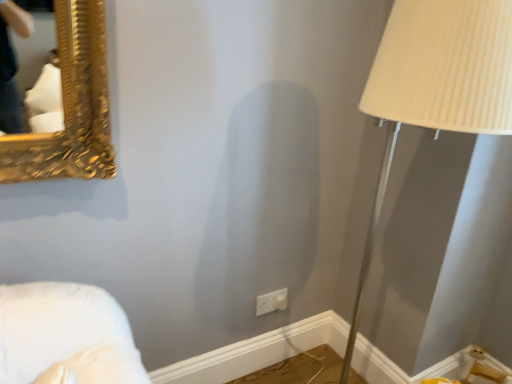
In order to face beige ribbed shade at right, should I rotate leftwards or rightwards?

Turn right approximately 16.696 degrees to face it.

Measure the distance between beige ribbed shade at right and camera.

The depth of beige ribbed shade at right is 27.94 inches.

Locate an element on the screen. This screenshot has height=384, width=512. beige ribbed shade at right is located at coordinates (436, 86).

Describe the element at coordinates (436, 86) in the screenshot. The image size is (512, 384). I see `beige ribbed shade at right` at that location.

Identify the location of white plastic electric outlet at lower center. This screenshot has width=512, height=384. (271, 301).

Describe the element at coordinates (271, 301) in the screenshot. I see `white plastic electric outlet at lower center` at that location.

Locate an element on the screen. beige ribbed shade at right is located at coordinates (436, 86).

Visually, is white plastic electric outlet at lower center positioned to the left or to the right of beige ribbed shade at right?

white plastic electric outlet at lower center is positioned on beige ribbed shade at right's left side.

Is white plastic electric outlet at lower center positioned in front of beige ribbed shade at right?

No, white plastic electric outlet at lower center is further to the viewer.

Between point (270, 295) and point (346, 373), which one is positioned behind?

The point (346, 373) is more distant.

From the image's perspective, is white plastic electric outlet at lower center over beige ribbed shade at right?

Incorrect, from the image's perspective, white plastic electric outlet at lower center is lower than beige ribbed shade at right.

From a real-world perspective, is white plastic electric outlet at lower center physically below beige ribbed shade at right?

Yes, from a real-world perspective, white plastic electric outlet at lower center is below beige ribbed shade at right.

Between white plastic electric outlet at lower center and beige ribbed shade at right, which one has smaller width?

With smaller width is white plastic electric outlet at lower center.

Is white plastic electric outlet at lower center taller than beige ribbed shade at right?

Incorrect, the height of white plastic electric outlet at lower center is not larger of that of beige ribbed shade at right.

Does white plastic electric outlet at lower center have a smaller size compared to beige ribbed shade at right?

Yes.

In the scene shown: Is white plastic electric outlet at lower center inside the boundaries of beige ribbed shade at right, or outside?

white plastic electric outlet at lower center cannot be found inside beige ribbed shade at right.

Is white plastic electric outlet at lower center next to beige ribbed shade at right?

They are not placed beside each other.

Does white plastic electric outlet at lower center turn towards beige ribbed shade at right?

Yes, white plastic electric outlet at lower center faces towards beige ribbed shade at right.

Can you tell me how much white plastic electric outlet at lower center and beige ribbed shade at right differ in facing direction?

90 degrees separate the facing orientations of white plastic electric outlet at lower center and beige ribbed shade at right.

Where is `electric outlet on the left of beige ribbed shade at right`? This screenshot has width=512, height=384. electric outlet on the left of beige ribbed shade at right is located at coordinates (271, 301).

Based on the photo, does beige ribbed shade at right appear on the right side of white plastic electric outlet at lower center?

Yes, beige ribbed shade at right is to the right of white plastic electric outlet at lower center.

Relative to white plastic electric outlet at lower center, is beige ribbed shade at right in front or behind?

Visually, beige ribbed shade at right is located in front of white plastic electric outlet at lower center.

Looking at this image, which is closer, (461, 51) or (276, 294)?

The point (461, 51) is in front.

From the image's perspective, who appears lower, beige ribbed shade at right or white plastic electric outlet at lower center?

white plastic electric outlet at lower center.

From a real-world perspective, is beige ribbed shade at right located beneath white plastic electric outlet at lower center?

No, from a real-world perspective, beige ribbed shade at right is not below white plastic electric outlet at lower center.

Based on the photo, considering the sizes of beige ribbed shade at right and white plastic electric outlet at lower center in the image, is beige ribbed shade at right wider or thinner than white plastic electric outlet at lower center?

beige ribbed shade at right is wider than white plastic electric outlet at lower center.

Can you confirm if beige ribbed shade at right is shorter than white plastic electric outlet at lower center?

In fact, beige ribbed shade at right may be taller than white plastic electric outlet at lower center.

Considering the sizes of objects beige ribbed shade at right and white plastic electric outlet at lower center in the image provided, who is smaller, beige ribbed shade at right or white plastic electric outlet at lower center?

white plastic electric outlet at lower center.

Consider the image. Choose the correct answer: Is beige ribbed shade at right inside white plastic electric outlet at lower center or outside it?

The correct answer is: outside.

Would you consider beige ribbed shade at right to be distant from white plastic electric outlet at lower center?

→ Yes, beige ribbed shade at right and white plastic electric outlet at lower center are quite far apart.

Could you tell me if beige ribbed shade at right is turned towards white plastic electric outlet at lower center?

No, beige ribbed shade at right is not facing towards white plastic electric outlet at lower center.

Locate an element on the screen. The height and width of the screenshot is (384, 512). electric outlet that appears on the left of beige ribbed shade at right is located at coordinates (271, 301).

The image size is (512, 384). Identify the location of electric outlet behind the beige ribbed shade at right. (271, 301).

Identify the location of electric outlet lying below the beige ribbed shade at right (from the image's perspective). Image resolution: width=512 pixels, height=384 pixels. point(271,301).